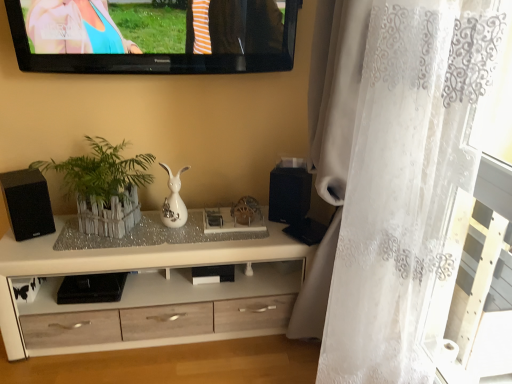
Image resolution: width=512 pixels, height=384 pixels. In order to click on empty space that is ontop of black matte speaker at center, which is counted as the second speaker, starting from the left (from a real-world perspective) in this screenshot , I will do `click(290, 167)`.